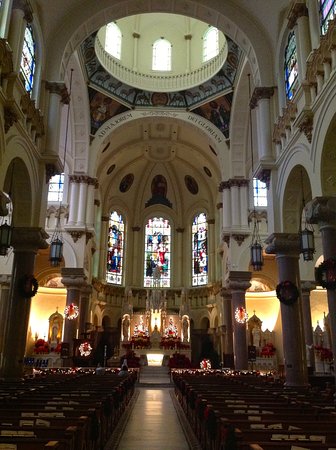
I want to click on hanging light, so [57, 249], [6, 241], [257, 257], [308, 243].